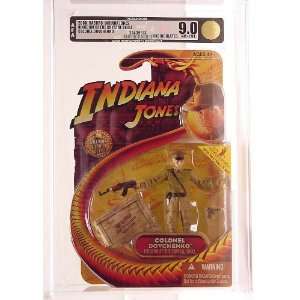
Find the location of a particular element. This screenshot has width=300, height=300. crate is located at coordinates (129, 220).